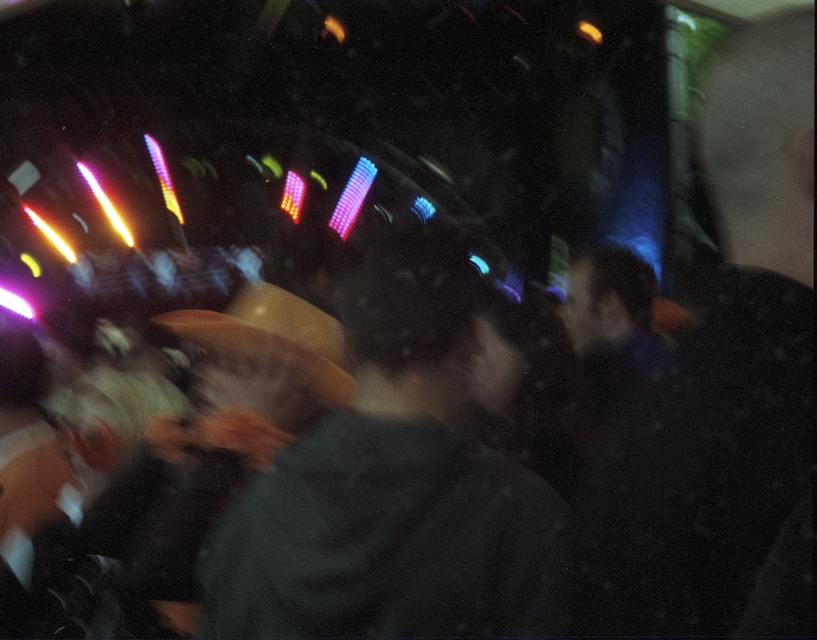
Looking at this image, you are at a party and want to find someone wearing a dark gray shirt at right and a dark gray sweater at center. Which clothing item is positioned higher in the image?

The dark gray shirt at right is positioned higher than the dark gray sweater at center in the image.

You are a photographer at this event and want to take a clear photo of both the dark gray shirt at right and the dark gray sweater at center. The camera has a minimum focus distance of 10 inches. Can you capture both subjects in focus without moving the camera?

The distance between the dark gray shirt at right and the dark gray sweater at center is 11.17 inches, which is greater than the camera minimum focus distance of 10 inches. Therefore, the camera can focus on both subjects simultaneously without moving.